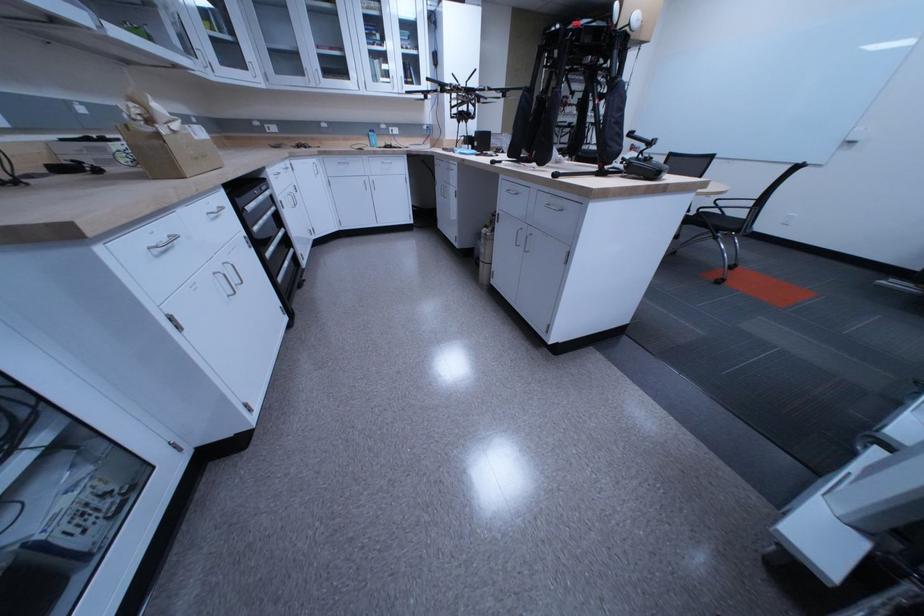
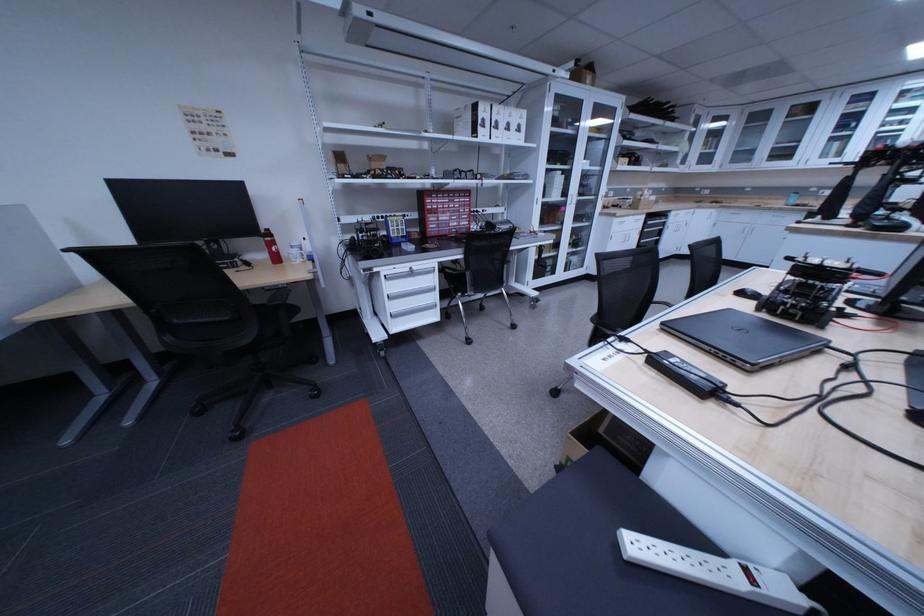
Locate, in the second image, the point that corresponds to (195,330) in the first image.

(626, 241)